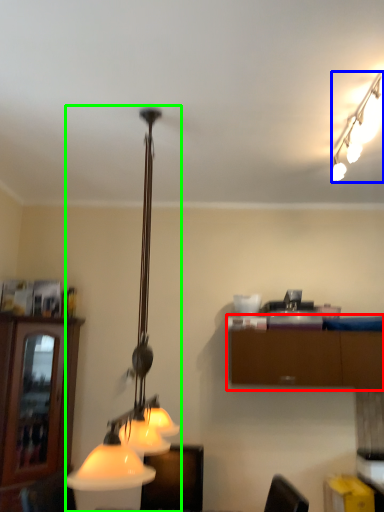
Question: Which is nearer to the cabinetry (highlighted by a red box)? lamp (highlighted by a blue box) or lamp (highlighted by a green box).

Choices:
 (A) lamp
 (B) lamp

Answer: (B)